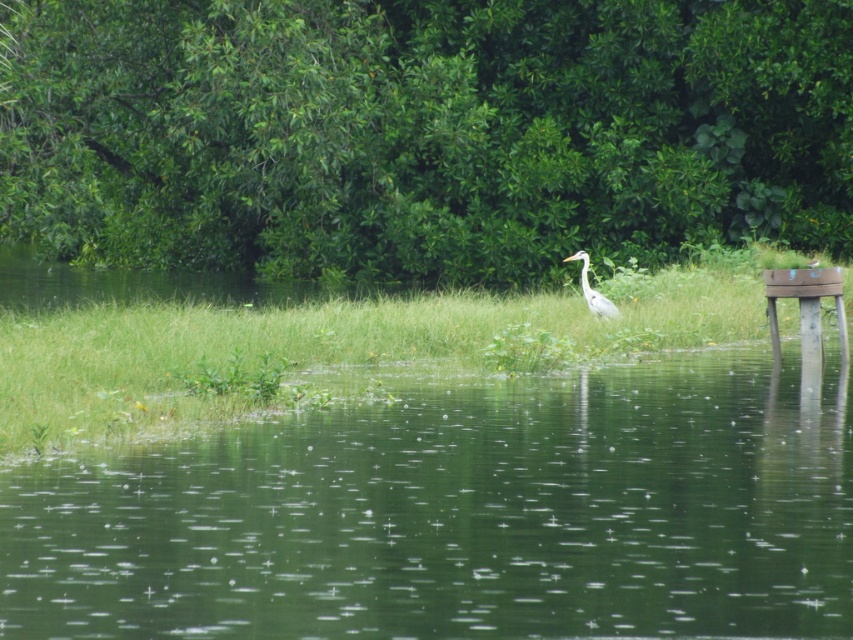
You are a hiker trying to determine which object is taller between the green leafy tree at center and the green grass at center. Based on the scene, which one is taller?

The green leafy tree at center is taller than the green grass at center.

You are a photographer aiming to capture the white smooth heron at center in your shot. Considering the green grass at center, how might its height affect your ability to see the heron clearly?

The green grass at center is taller than the white smooth heron at center, which means the grass may obstruct the view of the heron, making it harder to see clearly.